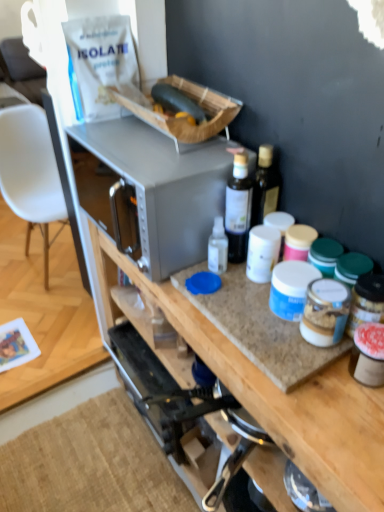
Question: Is transparent plastic bottle at center wider or thinner than white plastic chair at left?

Choices:
 (A) thin
 (B) wide

Answer: (A)

Question: Is transparent plastic bottle at center in front of or behind white plastic chair at left in the image?

Choices:
 (A) front
 (B) behind

Answer: (A)

Question: Which object is positioned closest to the green matte zucchini at upper center?

Choices:
 (A) satin silver microwave at center
 (B) granite countertop at center
 (C) white plastic chair at left
 (D) transparent plastic bottle at center

Answer: (A)

Question: Which object is the farthest from the granite countertop at center?

Choices:
 (A) white plastic chair at left
 (B) green matte zucchini at upper center
 (C) satin silver microwave at center
 (D) transparent plastic bottle at center

Answer: (A)